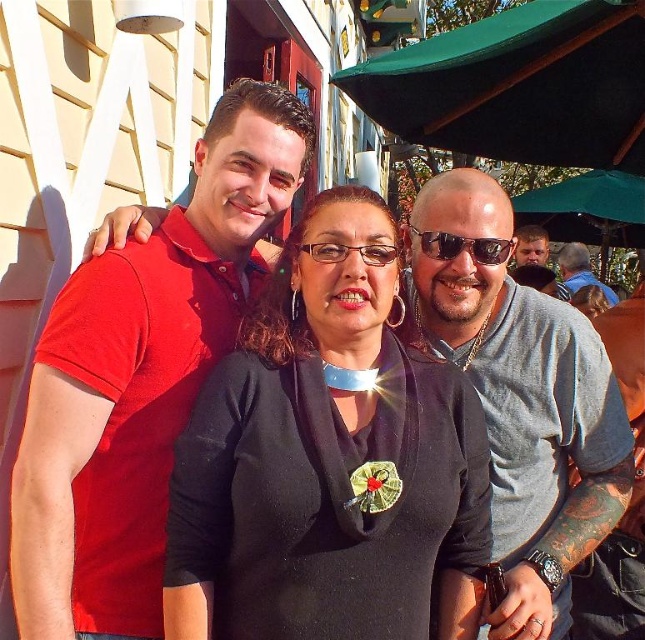
Question: Can you confirm if sunglasses at center is smaller than black leather jacket at center?

Choices:
 (A) no
 (B) yes

Answer: (B)

Question: Considering the relative positions of gray fabric shirt at right and black leather jacket at center in the image provided, where is gray fabric shirt at right located with respect to black leather jacket at center?

Choices:
 (A) below
 (B) above

Answer: (B)

Question: In this image, where is gold metallic medal at center located relative to transparent plastic glasses at center?

Choices:
 (A) below
 (B) above

Answer: (A)

Question: Which point is farther to the camera?

Choices:
 (A) (604, 536)
 (B) (493, 260)
 (C) (521, 228)

Answer: (C)

Question: Which object is positioned farthest from the gold metallic medal at center?

Choices:
 (A) gray fabric shirt at right
 (B) blue denim shirt at upper right
 (C) transparent plastic glasses at center
 (D) black fabric at center

Answer: (B)

Question: Which point is closer to the camera taking this photo?

Choices:
 (A) (455, 236)
 (B) (608, 301)
 (C) (502, 548)
 (D) (522, 227)

Answer: (A)